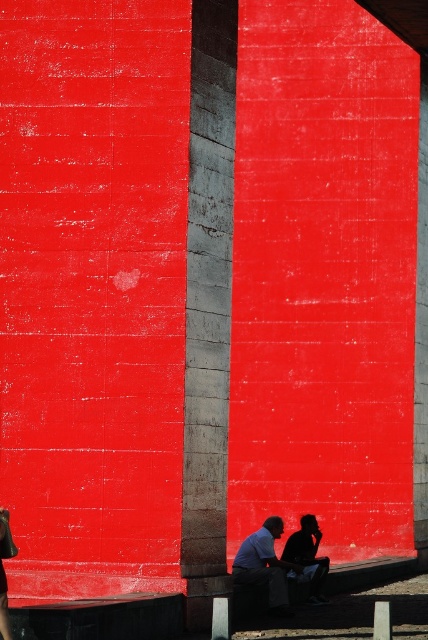
Who is shorter, concrete pillar at center or matte blue shirt at lower center?

With less height is matte blue shirt at lower center.

Is concrete pillar at center wider than matte blue shirt at lower center?

Yes, concrete pillar at center is wider than matte blue shirt at lower center.

Is point (213, 497) in front of point (279, 596)?

Yes, point (213, 497) is closer to viewer.

Where is `concrete pillar at center`? concrete pillar at center is located at coordinates (208, 307).

Which is more to the left, concrete pillar at center or silhouette fabric at lower right?

Positioned to the left is concrete pillar at center.

You are a GUI agent. You are given a task and a screenshot of the screen. Output one action in this format:
    pyautogui.click(x=<x>, y=<y>)
    Task: Click on the concrete pillar at center
    The width and height of the screenshot is (428, 640).
    Given the screenshot: What is the action you would take?
    pyautogui.click(x=208, y=307)

Image resolution: width=428 pixels, height=640 pixels. Identify the location of concrete pillar at center. (208, 307).

Does point (282, 596) lie behind point (296, 577)?

No, (282, 596) is in front of (296, 577).

Based on the photo, does matte blue shirt at lower center appear on the right side of silhouette fabric at lower right?

Incorrect, matte blue shirt at lower center is not on the right side of silhouette fabric at lower right.

Between point (285, 588) and point (296, 541), which one is positioned in front?

Point (285, 588)

Image resolution: width=428 pixels, height=640 pixels. Find the location of `matte blue shirt at lower center`. matte blue shirt at lower center is located at coordinates (264, 564).